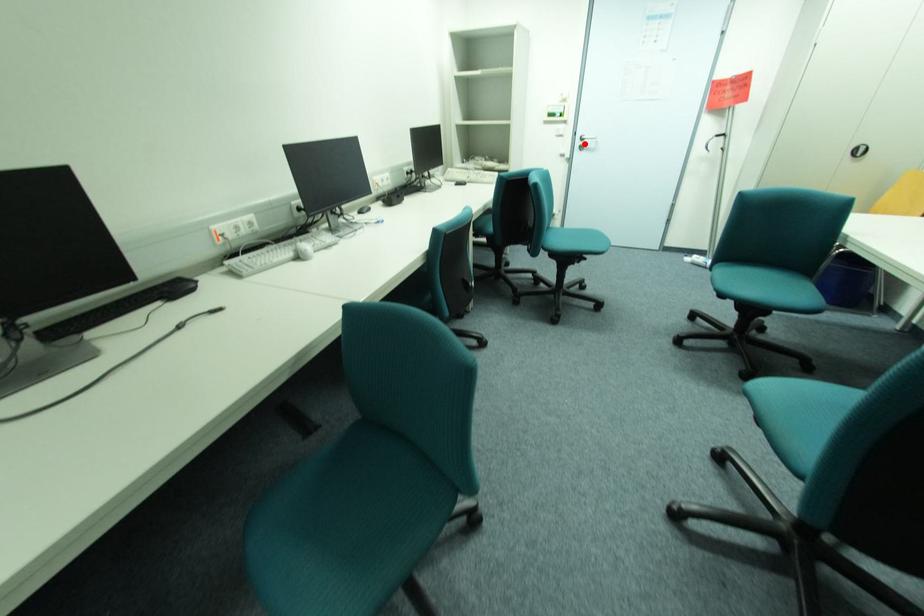
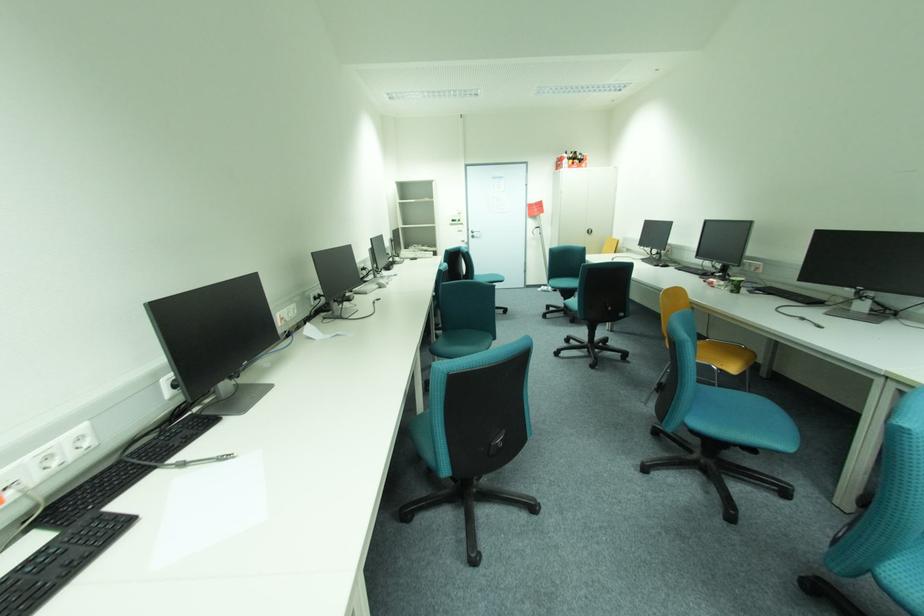
Where in the second image is the point corresponding to the highlighted location from the first image?

(477, 235)